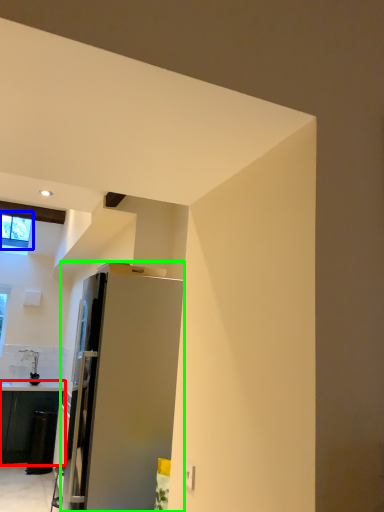
Question: Estimate the real-world distances between objects in this image. Which object is closer to cabinetry (highlighted by a red box), window (highlighted by a blue box) or refrigerator (highlighted by a green box)?

Choices:
 (A) window
 (B) refrigerator

Answer: (A)